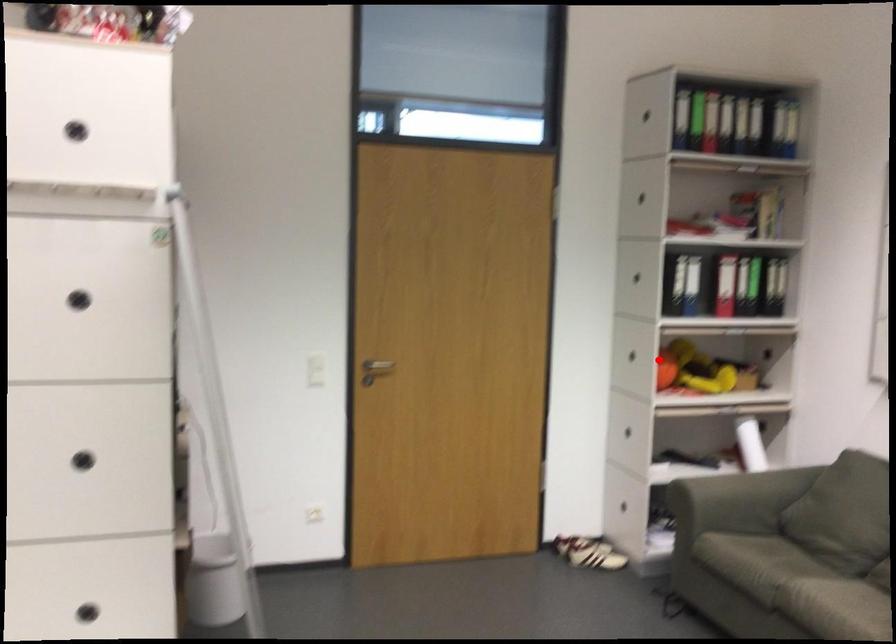
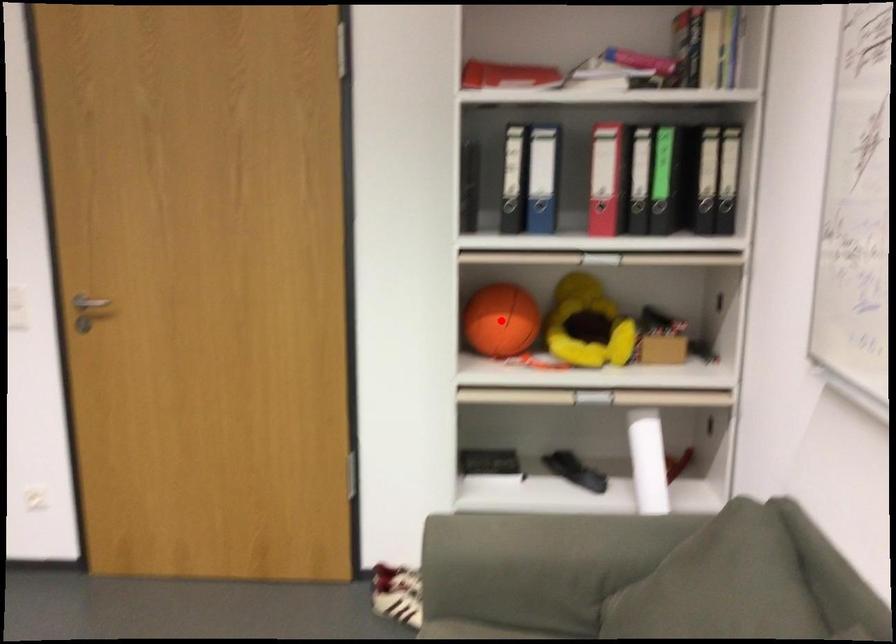
I am providing you with two images of the same scene from different viewpoints. A red point is marked on the first image and another point is marked on the second image. Does the point marked in image1 correspond to the same location as the one in image2?

Yes